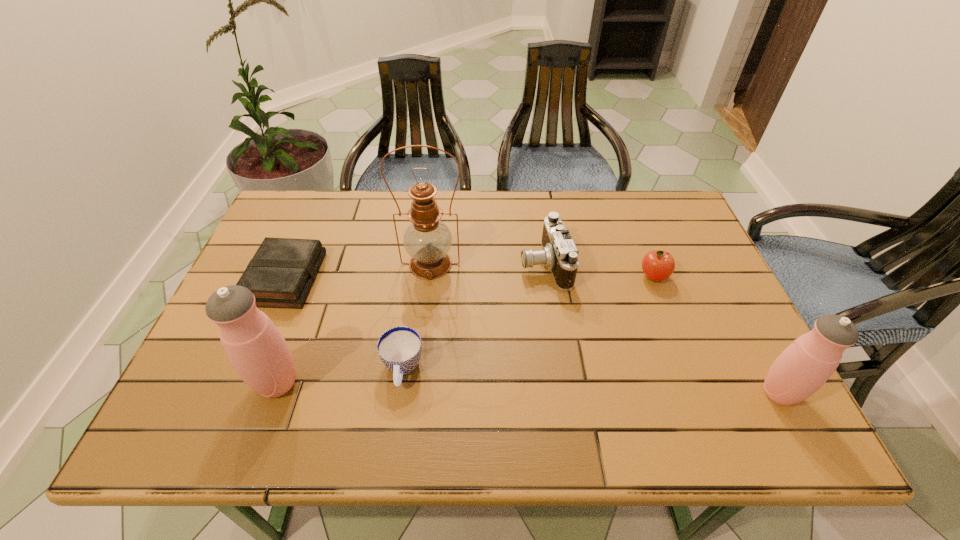
Identify the location of vacant spot for a new thermos_bottle to ensure equal spacing. (526, 388).